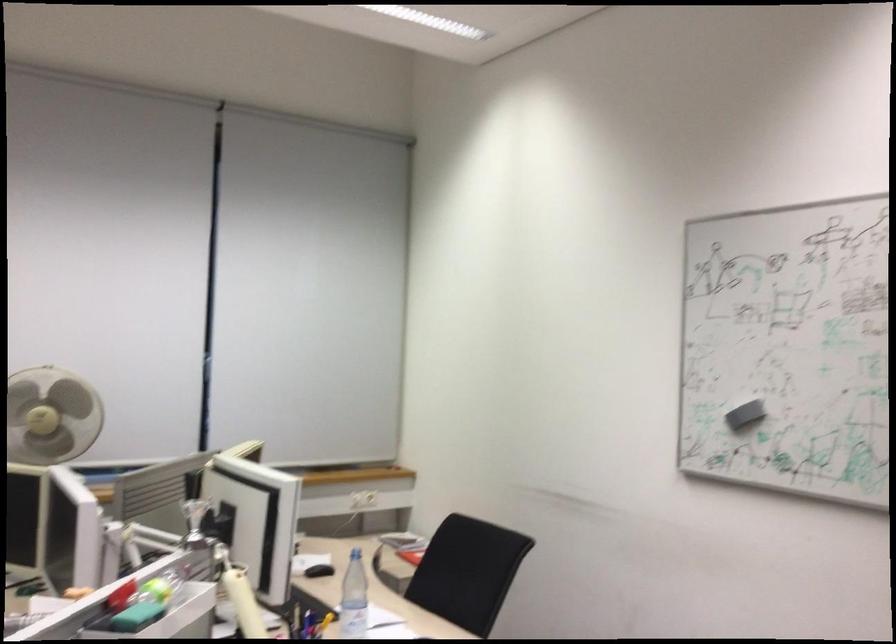
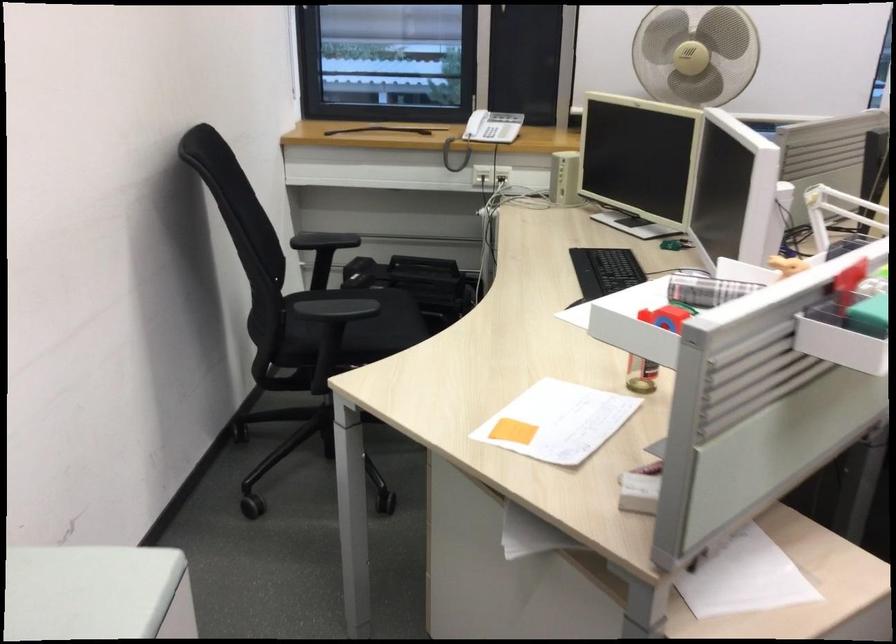
The images are taken continuously from a first-person perspective. In which direction is your viewpoint rotating?

The rotation direction of the camera is left-down.